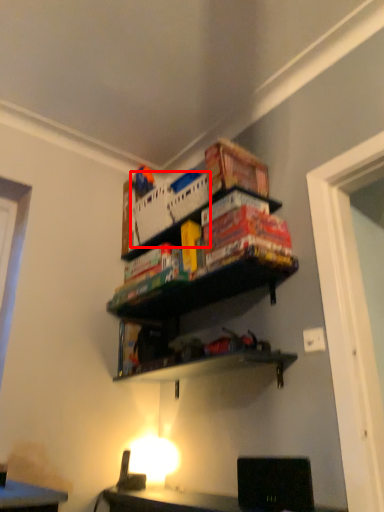
Question: From the image's perspective, where is crate (annotated by the red box) located relative to shelf?

Choices:
 (A) below
 (B) above

Answer: (B)